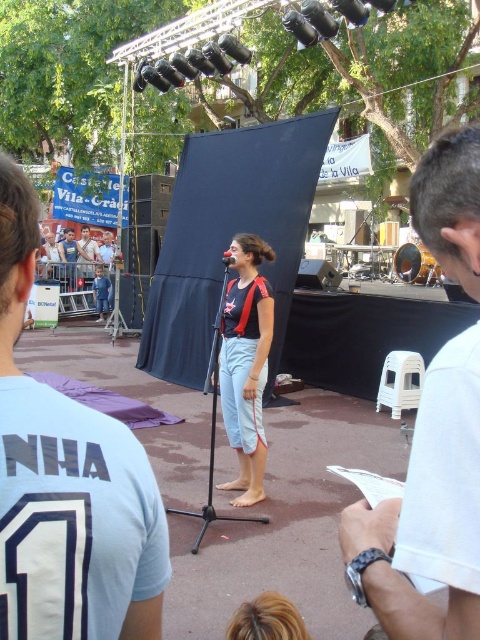
You are a costume designer preparing for a performance. You have two options for the lead singer, the white cotton shirt at center and the matte black tank top at center. The director wants the shorter one to be worn. Which should you choose?

The white cotton shirt at center is shorter than the matte black tank top at center, so you should choose the white cotton shirt at center.

You are a costume designer looking at the performer on stage. You notice two clothing items at the center of the stage. Which one is positioned to the left of the other? The two items are the white cotton shirt at center and the matte black tank top at center.

The white cotton shirt at center is positioned to the left of the matte black tank top at center.